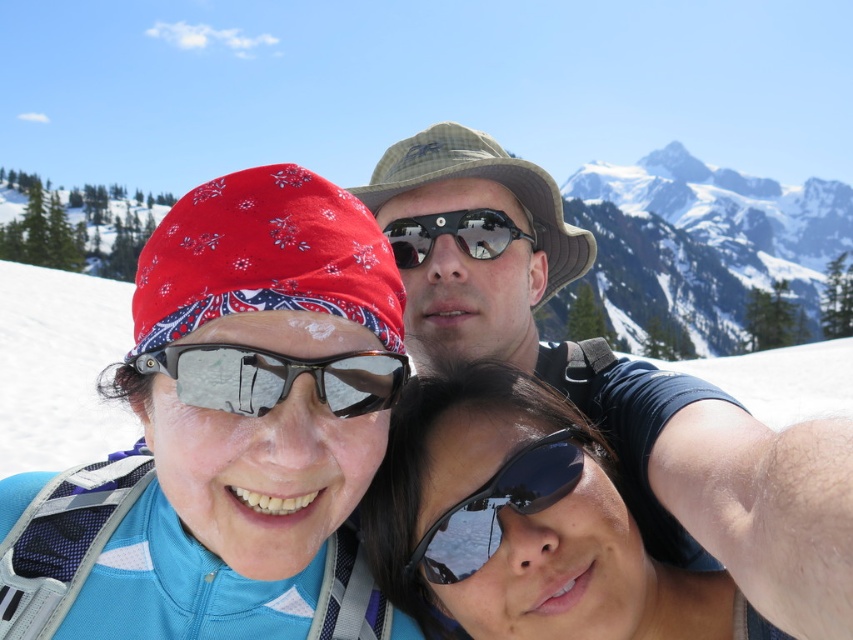
Question: Does transparent plastic goggles at center come behind black reflective sunglasses at center?

Choices:
 (A) yes
 (B) no

Answer: (B)

Question: Estimate the real-world distances between objects in this image. Which object is closer to the black reflective sunglasses at lower center?

Choices:
 (A) black reflective sunglasses at center
 (B) sunglasses at center
 (C) camouflage fabric hat at center
 (D) transparent plastic goggles at center

Answer: (A)

Question: Which point is closer to the camera?

Choices:
 (A) (521, 552)
 (B) (643, 465)
 (C) (842, 214)
 (D) (508, 493)

Answer: (A)

Question: Which of these objects is positioned closest to the sunglasses at center?

Choices:
 (A) snowy white mountain at upper center
 (B) camouflage fabric hat at center
 (C) black reflective sunglasses at center

Answer: (B)

Question: Can you confirm if black reflective sunglasses at lower center is positioned above sunglasses at center?

Choices:
 (A) no
 (B) yes

Answer: (A)

Question: Does transparent plastic goggles at center have a greater width compared to black reflective sunglasses at center?

Choices:
 (A) yes
 (B) no

Answer: (A)